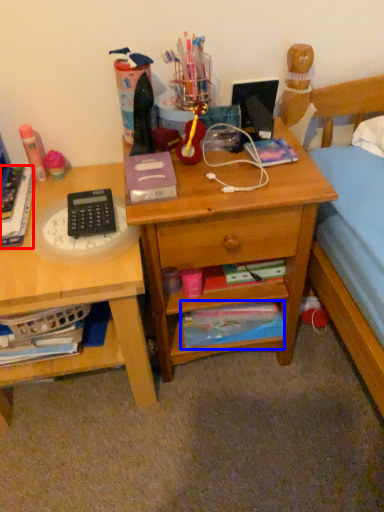
Question: Among these objects, which one is farthest to the camera, book (highlighted by a red box) or paperback book (highlighted by a blue box)?

Choices:
 (A) book
 (B) paperback book

Answer: (B)